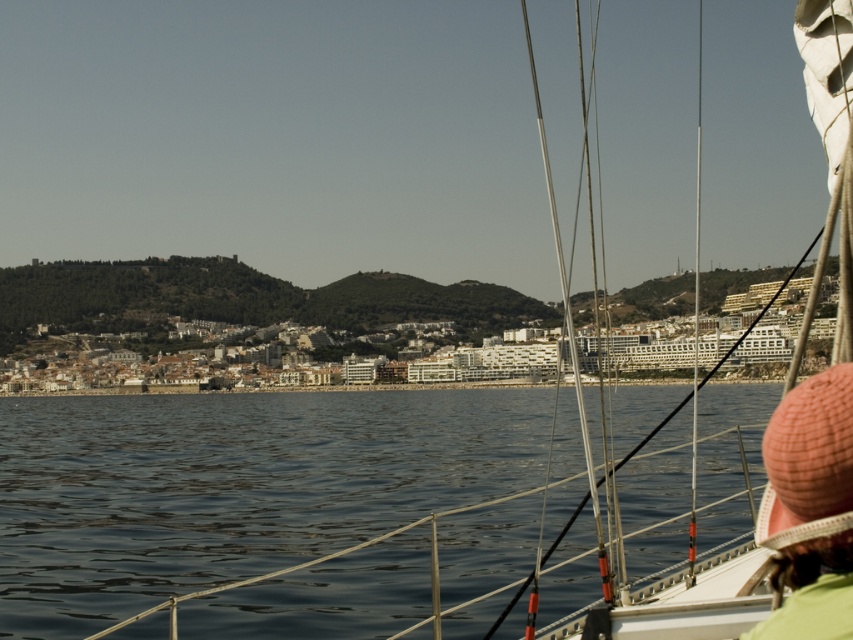
You are standing on the deck of the sailboat and notice the pink knitted hat at lower right and the metallic silver mast at right. Which object appears taller in the scene?

The metallic silver mast at right appears taller than the pink knitted hat at lower right.

You are on a sailboat and want to take a photo of the dark blue water at center and the pink knitted hat at lower right. Which object will appear larger in the photo?

The dark blue water at center will appear larger in the photo because it is much taller than the pink knitted hat at lower right.